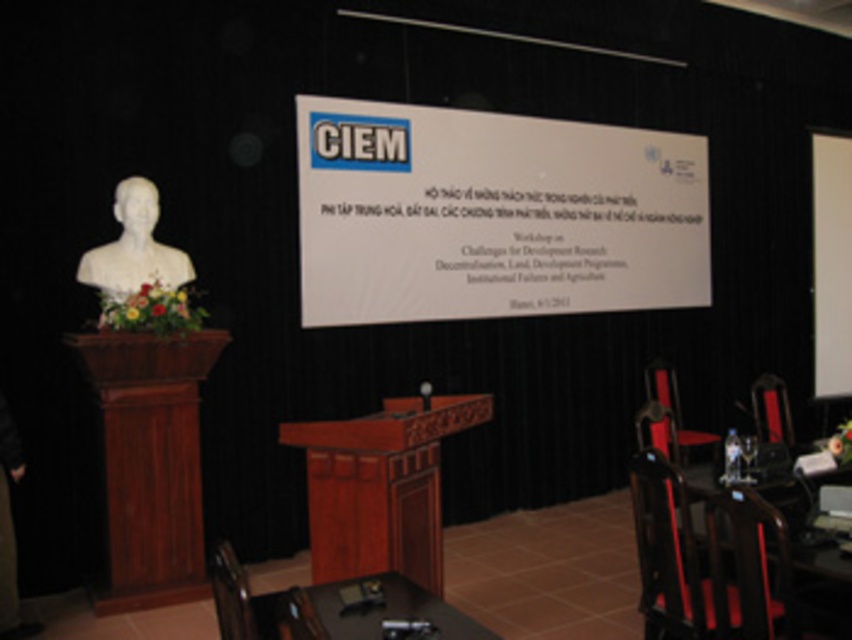
Is point (632, 282) positioned before point (275, 605)?

No, (632, 282) is behind (275, 605).

Can you confirm if white paper at center is thinner than wooden chair at lower left?

In fact, white paper at center might be wider than wooden chair at lower left.

Image resolution: width=852 pixels, height=640 pixels. Describe the element at coordinates (492, 214) in the screenshot. I see `white paper at center` at that location.

At what (x,y) coordinates should I click in order to perform the action: click on white paper at center. Please return your answer as a coordinate pair (x, y). The height and width of the screenshot is (640, 852). Looking at the image, I should click on (492, 214).

Measure the distance between point (842, 161) and camera.

Point (842, 161) and camera are 25.11 feet apart.

Is white matte projection screen at upper right to the right of matte black chair at right from the viewer's perspective?

Indeed, white matte projection screen at upper right is positioned on the right side of matte black chair at right.

The height and width of the screenshot is (640, 852). I want to click on white matte projection screen at upper right, so click(832, 262).

You are a GUI agent. You are given a task and a screenshot of the screen. Output one action in this format:
    pyautogui.click(x=<x>, y=<y>)
    Task: Click on the white matte projection screen at upper right
    The width and height of the screenshot is (852, 640).
    Given the screenshot: What is the action you would take?
    pyautogui.click(x=832, y=262)

Does point (672, 388) come in front of point (778, 394)?

Yes, point (672, 388) is in front of point (778, 394).

Who is lower down, velvet red chair at right or matte black chair at right?

velvet red chair at right

Who is more distant from viewer, (654,380) or (767,419)?

The point (654,380) is behind.

The image size is (852, 640). I want to click on velvet red chair at right, so click(675, 408).